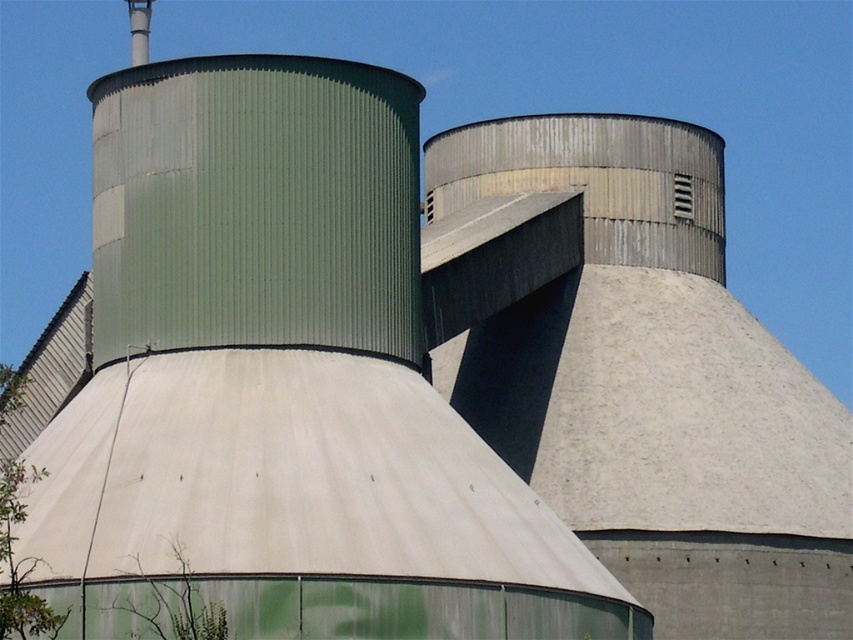
You are an inspector standing at the entrance of the industrial facility. You see the green corrugated metal plant at lower left and the green matte plant at lower left. Which one is closer to you?

The green corrugated metal plant at lower left is closer to you because it is in front of the green matte plant at lower left.

You are an engineer inspecting the industrial facility. You need to access the green corrugated metal plant at lower left and the green matte plant at lower left. Which one should you approach first if you want to reach the one on the left side first?

The green corrugated metal plant at lower left is to the left of the green matte plant at lower left, so you should approach the green corrugated metal plant at lower left first to reach the one on the left side.